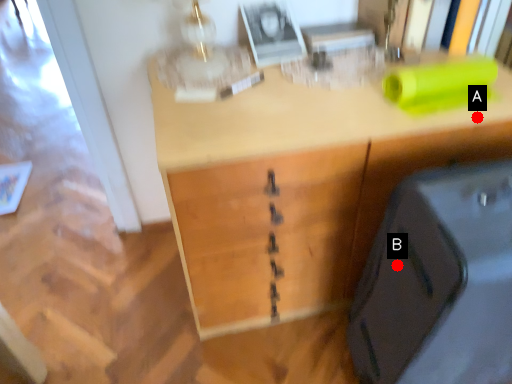
Question: Two points are circled on the image, labeled by A and B beside each circle. Which point appears farthest from the camera in this image?

Choices:
 (A) A is further
 (B) B is further

Answer: (A)